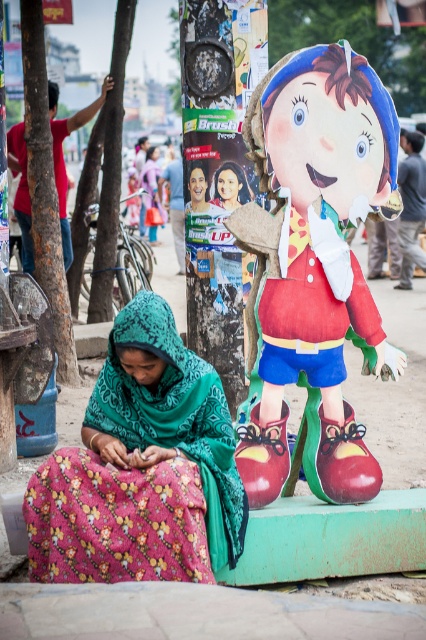
You are a delivery person with a box that is 3 meters long. You need to place the box between the cardboard doll at center and the matte plastic portrait at center. Can the box fit between them without overlapping either object?

The cardboard doll at center and the matte plastic portrait at center are 2.51 meters apart from each other. Since the box is 3 meters long, it cannot fit between them without overlapping one of the objects.